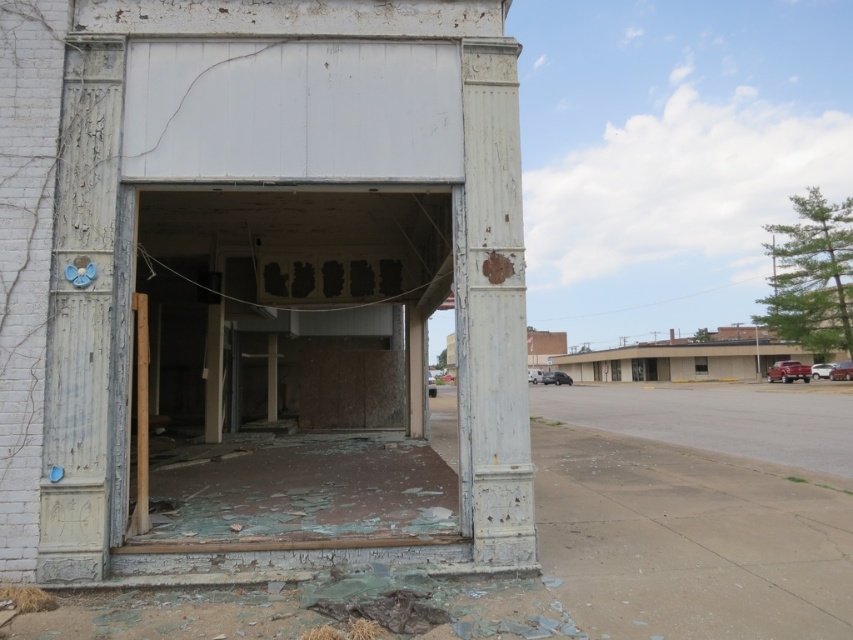
Question: Can you confirm if peeling paint garage door at center is positioned above white peeling paint at upper center?

Choices:
 (A) no
 (B) yes

Answer: (A)

Question: Is peeling paint garage door at center below white peeling paint at upper center?

Choices:
 (A) no
 (B) yes

Answer: (B)

Question: Is peeling paint garage door at center positioned before white peeling paint at upper center?

Choices:
 (A) yes
 (B) no

Answer: (B)

Question: Which point is farther from the camera taking this photo?

Choices:
 (A) (409, 356)
 (B) (506, 301)

Answer: (A)

Question: Which of the following is the closest to the observer?

Choices:
 (A) (514, 296)
 (B) (418, 348)

Answer: (A)